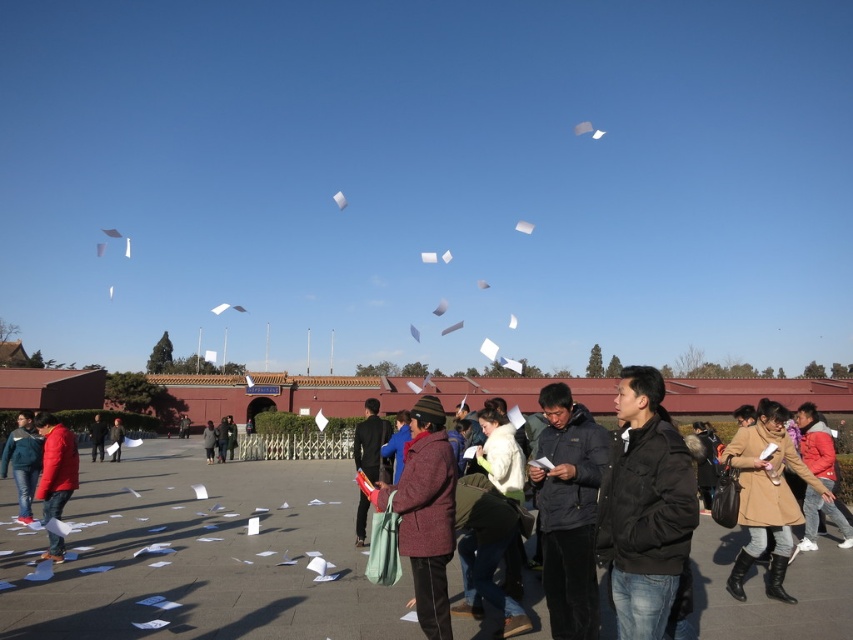
You are a photographer positioned at the edge of the plaza. You need to capture a photo that includes both the matte blue jacket at lower left and the dark gray jacket at center. Which jacket should you adjust your camera angle to focus on first to ensure both are in frame?

The matte blue jacket at lower left is smaller than the dark gray jacket at center. To ensure both are in frame, focus on the larger dark gray jacket at center first, then adjust to include the smaller matte blue jacket at lower left.

You are a photographer positioned at the center of the scene. You want to capture a photo that includes both the matte red jacket at lower left and the dark brown leather jacket at center. Given their distance apart, will they both fit in your camera frame if your camera has a field of view that can capture a width of 20 meters?

The matte red jacket at lower left and dark brown leather jacket at center are 20.77 meters apart. Since the camera can only capture a width of 20 meters, they will not both fit in the frame.